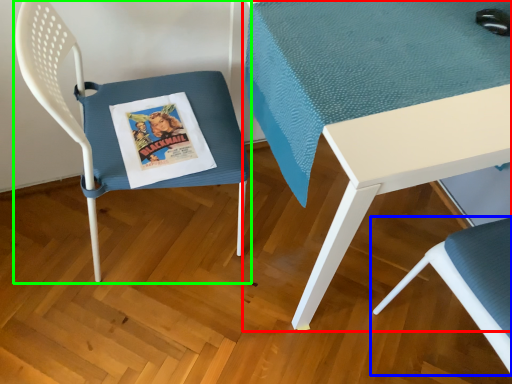
Question: Estimate the real-world distances between objects in this image. Which object is farther from table (highlighted by a red box), chair (highlighted by a blue box) or chair (highlighted by a green box)?

Choices:
 (A) chair
 (B) chair

Answer: (A)